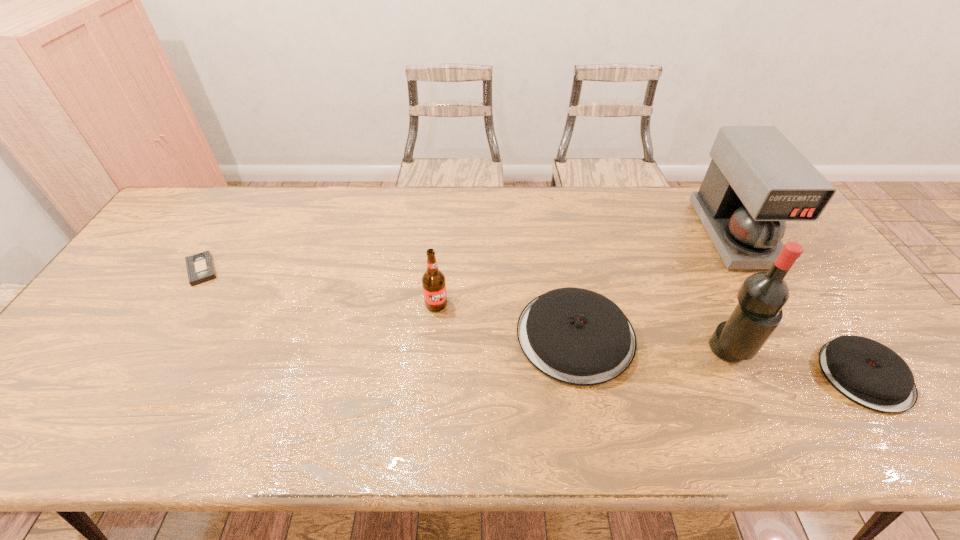
Identify the location of free space between the root beer and the shorter pancake. Image resolution: width=960 pixels, height=540 pixels. (650, 340).

Locate an element on the screen. free spot between the shortest object and the third object from left to right is located at coordinates (389, 303).

Locate an element on the screen. Image resolution: width=960 pixels, height=540 pixels. free point between the videotape and the fourth shortest object is located at coordinates (319, 287).

Identify the location of vacant point located between the second object from left to right and the shorter pancake. This screenshot has width=960, height=540. (650, 340).

Locate an element on the screen. The width and height of the screenshot is (960, 540). blank region between the left pancake and the tallest object is located at coordinates (652, 344).

Locate an element on the screen. The image size is (960, 540). object that is the fifth closest to the fifth object from right to left is located at coordinates (868, 373).

Identify the location of object that can be found as the fifth closest to the second shortest object. Image resolution: width=960 pixels, height=540 pixels. (200, 268).

I want to click on vacant region that satisfies the following two spatial constraints: 1. on the front side of the videotape; 2. on the left side of the shorter pancake, so pyautogui.click(x=136, y=375).

The width and height of the screenshot is (960, 540). In order to click on free space that satisfies the following two spatial constraints: 1. on the front side of the shorter pancake; 2. on the right side of the third object from left to right in this screenshot , I will do `click(583, 375)`.